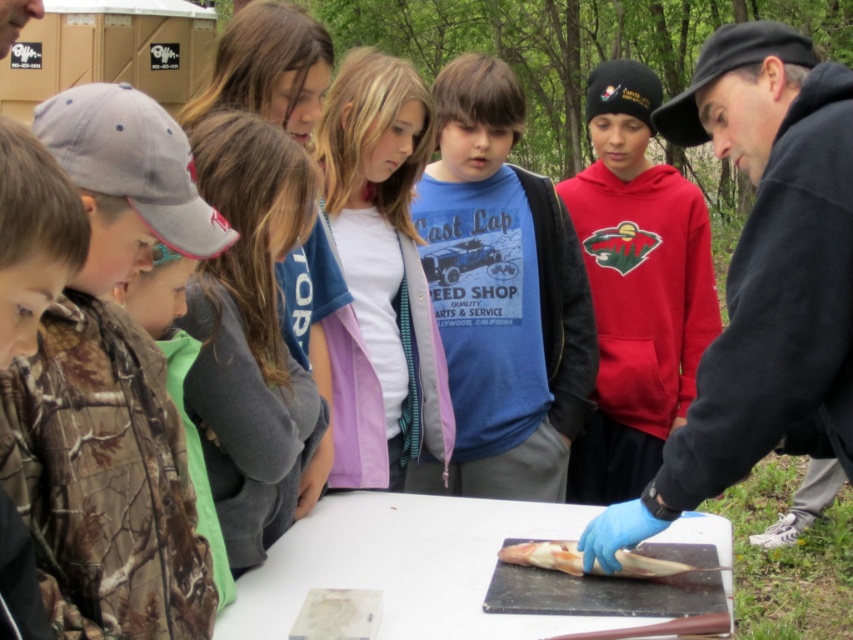
Between white matte table at center and pinkish translucent fish at center, which one appears on the right side from the viewer's perspective?

pinkish translucent fish at center is more to the right.

Measure the distance between white matte table at center and pinkish translucent fish at center.

white matte table at center is 25.16 centimeters away from pinkish translucent fish at center.

Locate an element on the screen. The width and height of the screenshot is (853, 640). white matte table at center is located at coordinates (408, 566).

Between pink fabric jacket at center and camo fabric shirt at left, which one has more height?

pink fabric jacket at center

Between point (413, 228) and point (28, 294), which one is positioned behind?

The point (413, 228) is more distant.

You are a GUI agent. You are given a task and a screenshot of the screen. Output one action in this format:
    pyautogui.click(x=<x>, y=<y>)
    Task: Click on the pink fabric jacket at center
    This screenshot has width=853, height=640.
    Given the screenshot: What is the action you would take?
    coord(380,275)

Does camouflage jacket at left have a greater height compared to camouflage fabric shirt at left?

In fact, camouflage jacket at left may be shorter than camouflage fabric shirt at left.

Who is higher up, camouflage jacket at left or camouflage fabric shirt at left?

camouflage fabric shirt at left is above.

Who is more distant from viewer, (x=149, y=496) or (x=273, y=320)?

The point (x=273, y=320) is more distant.

Image resolution: width=853 pixels, height=640 pixels. I want to click on camouflage jacket at left, so click(x=111, y=387).